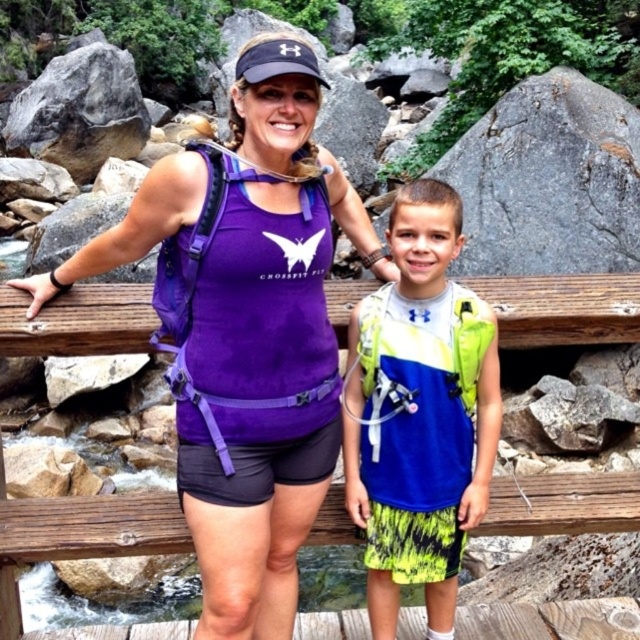
Question: Does purple fabric tank top at center have a greater width compared to neon green mesh tank top at center?

Choices:
 (A) no
 (B) yes

Answer: (B)

Question: Which object is the farthest from the purple fabric tank top at center?

Choices:
 (A) purple fabric bench at center
 (B) wooden at center
 (C) neon green mesh tank top at center

Answer: (B)

Question: Which object is closer to the camera taking this photo?

Choices:
 (A) purple fabric bench at center
 (B) neon green mesh tank top at center
 (C) wooden at center
 (D) purple fabric tank top at center

Answer: (D)

Question: Is purple fabric tank top at center positioned at the back of neon green mesh tank top at center?

Choices:
 (A) no
 (B) yes

Answer: (A)

Question: Observing the image, what is the correct spatial positioning of neon green mesh tank top at center in reference to purple fabric bench at center?

Choices:
 (A) below
 (B) above

Answer: (A)

Question: Which is farther from the wooden at center?

Choices:
 (A) neon green mesh tank top at center
 (B) purple fabric bench at center

Answer: (B)